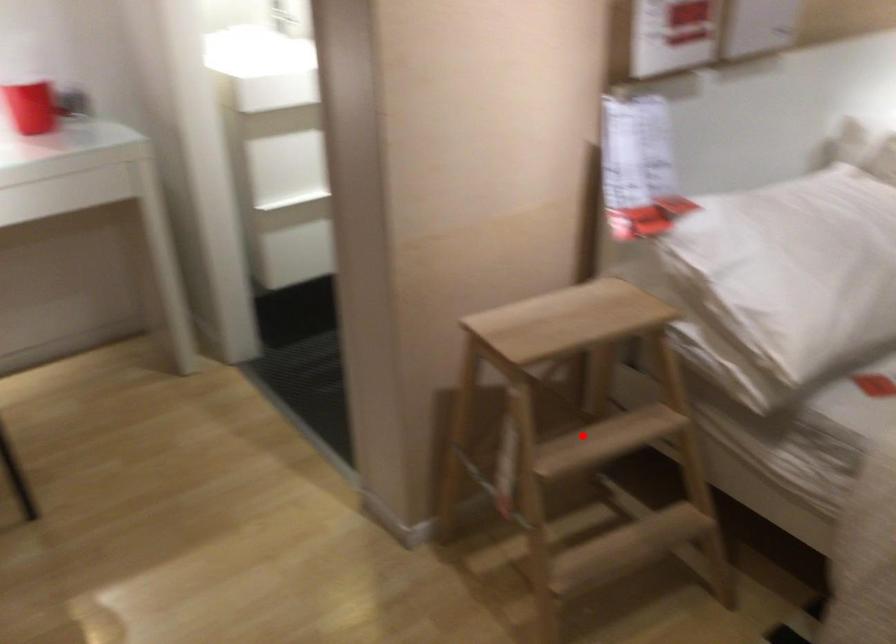
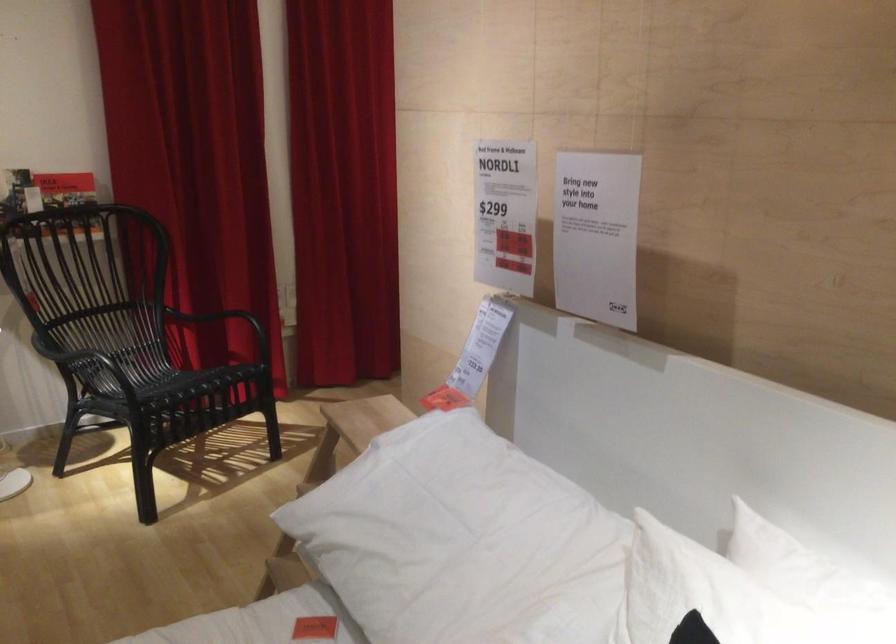
Question: I am providing you with two images of the same scene from different viewpoints. A red point is marked on the first image. Is the red point's position out of view in image 2?

Choices:
 (A) Yes
 (B) No

Answer: (A)